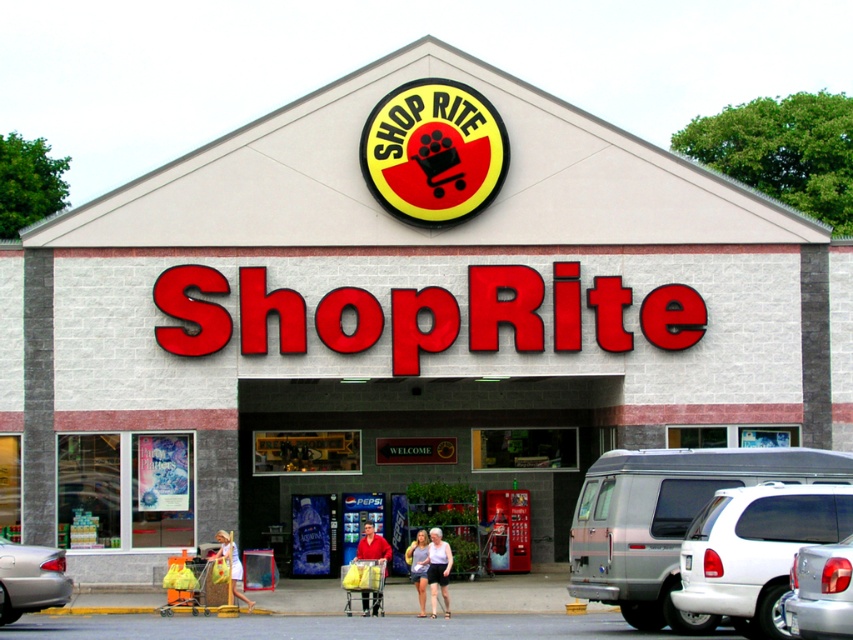
You are standing at the entrance of the ShopRite grocery store and notice two points marked on the ground. The first point is labeled as point [689,586] and the second as point [22,566]. Based on their positions, which point is closer to the entrance?

Point [22,566] is closer to the entrance because it is positioned below point [689,586], which is in front of it.

You are a customer arriving at the ShopRite store. You see a white matte SUV at lower right and a white cotton dress at center. Which object is closer to the store entrance?

The white matte SUV at lower right is closer to the store entrance because it is in front of the white cotton dress at center.

You are a customer arriving at the ShopRite store. You see a white matte suv at lower right and a silver metallic sedan at lower left. Which vehicle is closer to the store entrance?

The white matte suv at lower right is closer to the store entrance because it is in front of the silver metallic sedan at lower left.